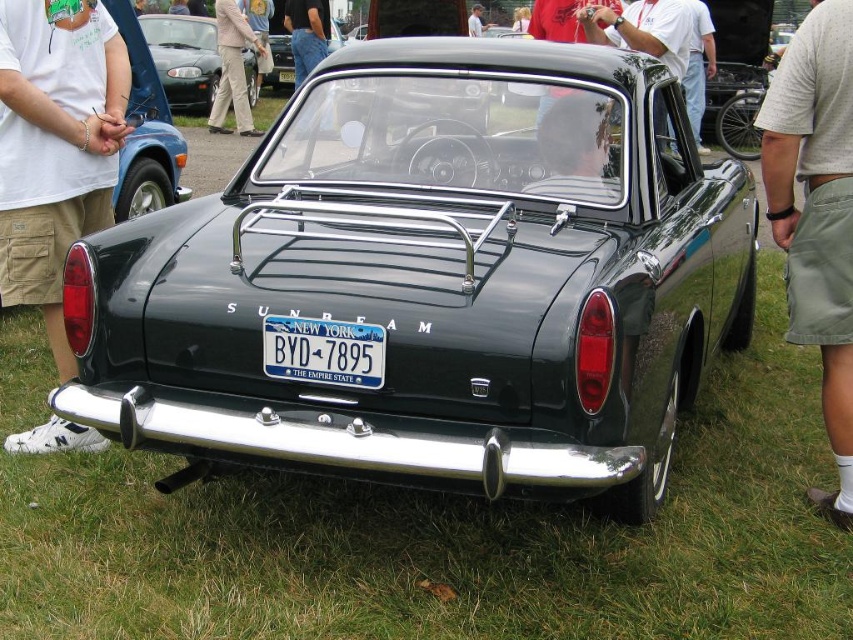
Question: Can you confirm if metallic blue car at center is wider than khaki pants at center?

Choices:
 (A) no
 (B) yes

Answer: (A)

Question: Among these objects, which one is nearest to the camera?

Choices:
 (A) green grass at center
 (B) white cotton shirt at upper left

Answer: (A)

Question: Does khaki pants at center lie in front of white fabric shirt at center?

Choices:
 (A) no
 (B) yes

Answer: (B)

Question: Which object appears closest to the camera in this image?

Choices:
 (A) white fabric shirt at center
 (B) green grass at center

Answer: (B)

Question: Considering the relative positions of white cotton shirt at upper left and green metallic car at center in the image provided, where is white cotton shirt at upper left located with respect to green metallic car at center?

Choices:
 (A) right
 (B) left

Answer: (A)

Question: Which of the following is the farthest from the observer?

Choices:
 (A) white fabric shirt at center
 (B) blue jeans at center
 (C) white fabric shirt at upper center
 (D) blue metallic license plate at center

Answer: (A)